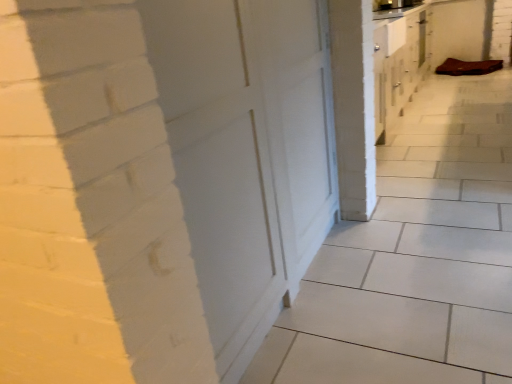
This screenshot has width=512, height=384. What are the coordinates of `white matte door at center` in the screenshot? It's located at (247, 152).

Describe the element at coordinates (247, 152) in the screenshot. The width and height of the screenshot is (512, 384). I see `white matte door at center` at that location.

This screenshot has height=384, width=512. I want to click on white matte door at center, so click(x=247, y=152).